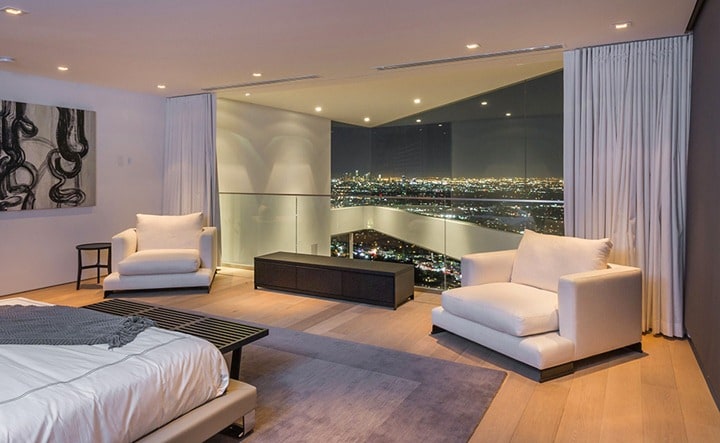
Where is `sheet`? The width and height of the screenshot is (720, 443). sheet is located at coordinates (109, 354).